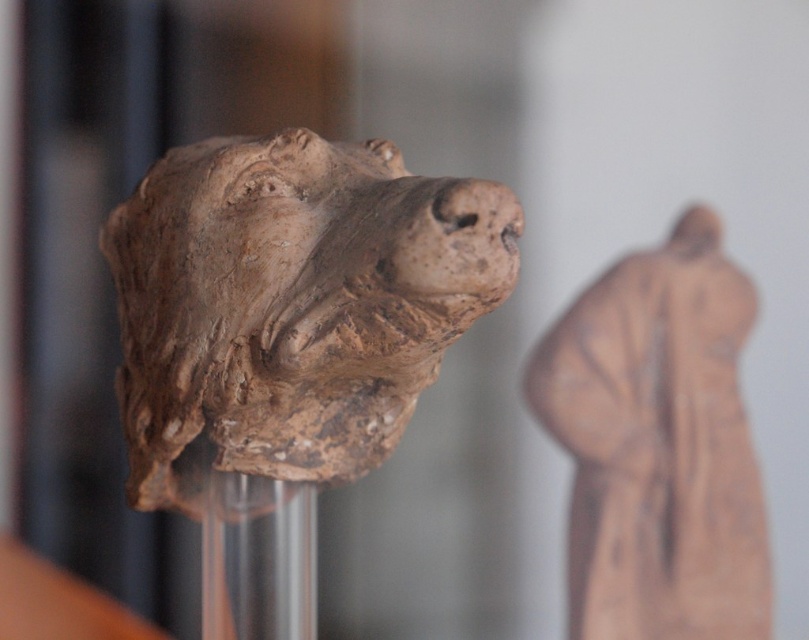
You are a museum curator who needs to move the brown clay head at center to a new display case located 1 meter away. Can you safely move it without it hitting the walls or other exhibits?

The distance between the brown clay head at center and the new display case is 92.33 centimeters. Since 92.33 cm is less than 1 meter, the curator can safely move the brown clay head at center to the new display case without it hitting walls or other exhibits.

You are a museum security guard checking the distance between the two artifacts. The museum requires that all artifacts be at least 1.5 meters apart for safety. Are the matte clay figure at center and the other artifact meeting this requirement?

The matte clay figure at center and the other artifact are 1.35 meters apart, which is less than the required 1.5 meters. They are not meeting the safety requirement.